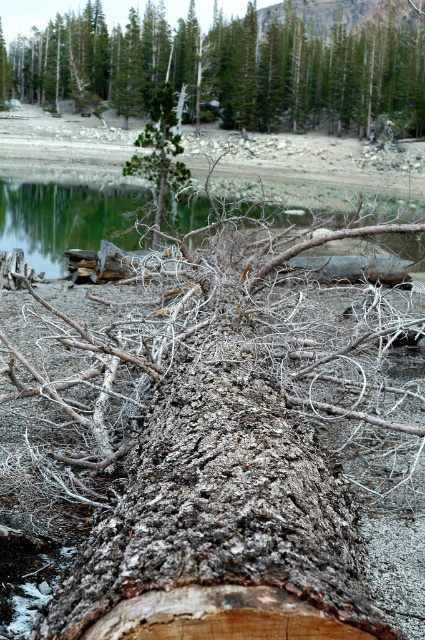
Is gray rough bark log at center positioned in front of green matte tree at center?

No.

Can you confirm if gray rough bark log at center is shorter than green matte tree at center?

Incorrect, gray rough bark log at center's height does not fall short of green matte tree at center's.

Measure the distance between gray rough bark log at center and camera.

gray rough bark log at center is 59.74 meters away from camera.

Where is `gray rough bark log at center`? The height and width of the screenshot is (640, 425). gray rough bark log at center is located at coordinates (314, 74).

Is point (297, 22) positioned behind point (96, 186)?

That is True.

What do you see at coordinates (314, 74) in the screenshot? I see `gray rough bark log at center` at bounding box center [314, 74].

Image resolution: width=425 pixels, height=640 pixels. Identify the location of gray rough bark log at center. (314, 74).

Identify the location of clear water at center. (65, 214).

Which is above, clear water at center or green matte tree at center?

Positioned higher is clear water at center.

Image resolution: width=425 pixels, height=640 pixels. Identify the location of clear water at center. (65, 214).